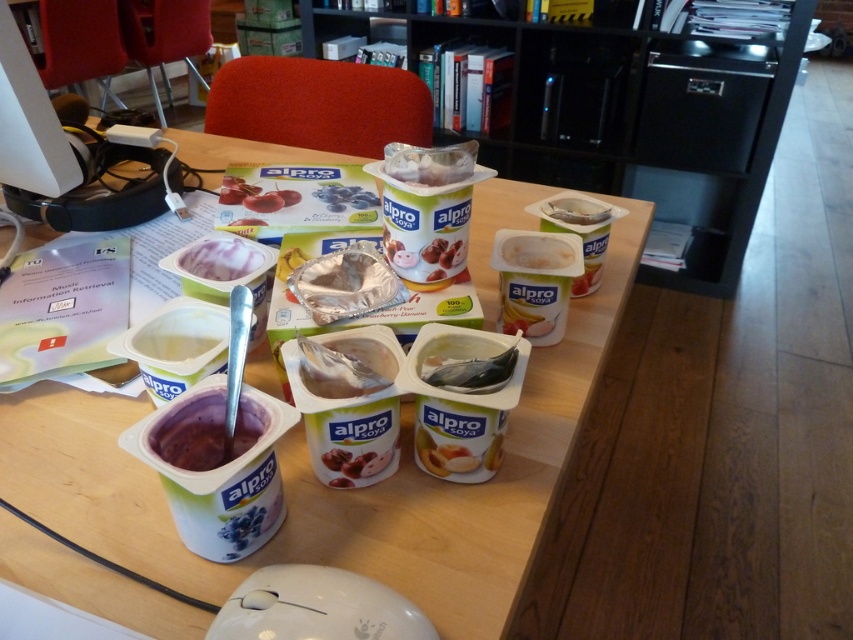
You are organizing items on the table and need to place a new item to the left of the white plastic table at center. Where should you place it in relation to the matte plastic yogurt cup at center?

Since the white plastic table at center is to the right of the matte plastic yogurt cup at center, placing an item to the left of the white plastic table at center would mean placing it to the right of the matte plastic yogurt cup at center.

You are organizing the workspace on the wooden table. You need to place a new item on the table. To ensure it doesn not block the view of the shiny silver foil at center, where should you place the new item relative to the matte plastic yogurt cup at center?

The shiny silver foil at center is below the matte plastic yogurt cup at center. To avoid blocking its view, place the new item above the matte plastic yogurt cup at center so it doesn not cover the shiny silver foil at center.

What is the exact position of the shiny silver foil at center on the table?

The shiny silver foil at center is located at point (344, 365).